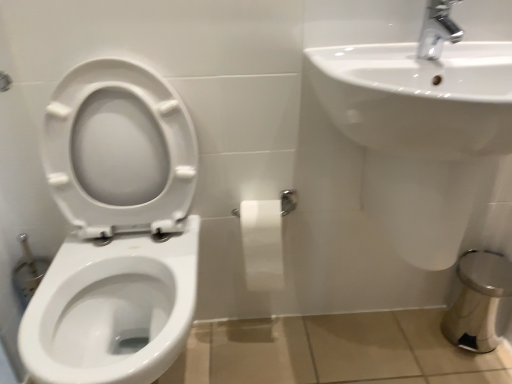
Question: From the image's perspective, is white glossy toilet at left below white glossy sink at upper right?

Choices:
 (A) no
 (B) yes

Answer: (B)

Question: Is white glossy toilet at left beside white glossy sink at upper right?

Choices:
 (A) no
 (B) yes

Answer: (A)

Question: From the image's perspective, is white glossy toilet at left above white glossy sink at upper right?

Choices:
 (A) yes
 (B) no

Answer: (B)

Question: Would you say white glossy toilet at left contains white glossy sink at upper right?

Choices:
 (A) yes
 (B) no

Answer: (B)

Question: Is white glossy toilet at left positioned behind white glossy sink at upper right?

Choices:
 (A) yes
 (B) no

Answer: (B)

Question: From a real-world perspective, is chrome metallic faucet at upper right positioned above or below white glossy toilet at left?

Choices:
 (A) above
 (B) below

Answer: (A)

Question: Considering the positions of chrome metallic faucet at upper right and white glossy toilet at left in the image, is chrome metallic faucet at upper right wider or thinner than white glossy toilet at left?

Choices:
 (A) thin
 (B) wide

Answer: (A)

Question: Would you say chrome metallic faucet at upper right is inside or outside white glossy toilet at left?

Choices:
 (A) inside
 (B) outside

Answer: (B)

Question: Is point (428, 26) closer or farther from the camera than point (181, 322)?

Choices:
 (A) farther
 (B) closer

Answer: (B)

Question: From a real-world perspective, is chrome metallic faucet at upper right positioned above or below white matte toilet paper at center?

Choices:
 (A) below
 (B) above

Answer: (B)

Question: Is point (429, 34) positioned closer to the camera than point (245, 218)?

Choices:
 (A) closer
 (B) farther

Answer: (A)

Question: Considering their positions, is chrome metallic faucet at upper right located in front of or behind white matte toilet paper at center?

Choices:
 (A) behind
 (B) front

Answer: (B)

Question: Is chrome metallic faucet at upper right wider or thinner than white matte toilet paper at center?

Choices:
 (A) wide
 (B) thin

Answer: (A)

Question: Looking at the image, does chrome metallic faucet at upper right seem bigger or smaller compared to white glossy sink at upper right?

Choices:
 (A) big
 (B) small

Answer: (B)

Question: Considering the positions of chrome metallic faucet at upper right and white glossy sink at upper right in the image, is chrome metallic faucet at upper right taller or shorter than white glossy sink at upper right?

Choices:
 (A) short
 (B) tall

Answer: (A)